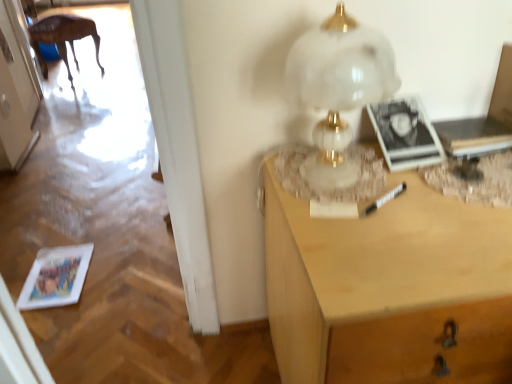
Question: Does white glossy door at upper left have a greater height compared to wooden table at left?

Choices:
 (A) yes
 (B) no

Answer: (A)

Question: Can you confirm if white glossy door at upper left is positioned to the left of wooden table at left?

Choices:
 (A) no
 (B) yes

Answer: (A)

Question: Is white glossy door at upper left located outside wooden table at left?

Choices:
 (A) yes
 (B) no

Answer: (A)

Question: Does white glossy door at upper left have a lesser height compared to wooden table at left?

Choices:
 (A) yes
 (B) no

Answer: (B)

Question: Is white glossy door at upper left oriented away from wooden table at left?

Choices:
 (A) yes
 (B) no

Answer: (B)

Question: From a real-world perspective, relative to white marble table lamp at upper right, is wooden table at left vertically above or below?

Choices:
 (A) above
 (B) below

Answer: (B)

Question: Is wooden table at left inside the boundaries of white marble table lamp at upper right, or outside?

Choices:
 (A) outside
 (B) inside

Answer: (A)

Question: Is wooden table at left bigger or smaller than white marble table lamp at upper right?

Choices:
 (A) big
 (B) small

Answer: (A)

Question: Is point (33, 44) positioned closer to the camera than point (347, 97)?

Choices:
 (A) closer
 (B) farther

Answer: (B)

Question: From the image's perspective, is wooden table at left above or below light wood desk at right?

Choices:
 (A) above
 (B) below

Answer: (A)

Question: Considering the positions of wooden table at left and light wood desk at right in the image, is wooden table at left bigger or smaller than light wood desk at right?

Choices:
 (A) big
 (B) small

Answer: (B)

Question: In the image, is wooden table at left positioned in front of or behind light wood desk at right?

Choices:
 (A) behind
 (B) front

Answer: (A)

Question: Choose the correct answer: Is wooden table at left inside light wood desk at right or outside it?

Choices:
 (A) outside
 (B) inside

Answer: (A)

Question: Considering the positions of light wood desk at right and white glossy door at upper left in the image, is light wood desk at right taller or shorter than white glossy door at upper left?

Choices:
 (A) tall
 (B) short

Answer: (B)

Question: Would you say light wood desk at right is inside or outside white glossy door at upper left?

Choices:
 (A) outside
 (B) inside

Answer: (A)